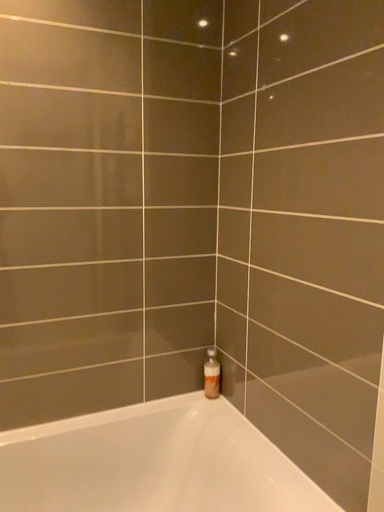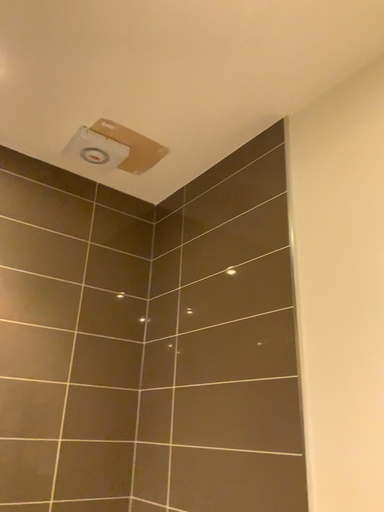
Question: Which way did the camera rotate in the video?

Choices:
 (A) rotated left
 (B) rotated right

Answer: (B)